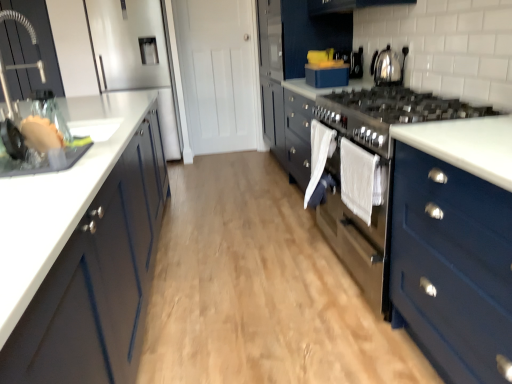
Question: Would you consider brushed metal faucet at left, the second cabinetry from the right, to be distant from matte blue dresser at center?

Choices:
 (A) yes
 (B) no

Answer: (A)

Question: From a real-world perspective, does brushed metal faucet at left, which is the 2th cabinetry from left to right, stand above matte blue dresser at center?

Choices:
 (A) yes
 (B) no

Answer: (A)

Question: Is brushed metal faucet at left, the second cabinetry from the right, completely or partially outside of matte blue dresser at center?

Choices:
 (A) yes
 (B) no

Answer: (A)

Question: Considering the relative sizes of brushed metal faucet at left, which is the 2th cabinetry from left to right, and matte blue dresser at center in the image provided, is brushed metal faucet at left, which is the 2th cabinetry from left to right, shorter than matte blue dresser at center?

Choices:
 (A) yes
 (B) no

Answer: (A)

Question: Can you confirm if brushed metal faucet at left, which is the 2th cabinetry from left to right, is bigger than matte blue dresser at center?

Choices:
 (A) yes
 (B) no

Answer: (B)

Question: Is brushed metal faucet at left, which is the 2th cabinetry from left to right, inside or outside of white fabric towel at center, which is counted as the first clothe, starting from the back?

Choices:
 (A) outside
 (B) inside

Answer: (A)

Question: From the image's perspective, is brushed metal faucet at left, the second cabinetry from the right, above or below white fabric towel at center, which is counted as the first clothe, starting from the back?

Choices:
 (A) above
 (B) below

Answer: (A)

Question: Relative to white fabric towel at center, which is the 2th clothe in front-to-back order, is brushed metal faucet at left, the second cabinetry from the right, in front or behind?

Choices:
 (A) front
 (B) behind

Answer: (A)

Question: From a real-world perspective, is brushed metal faucet at left, which is the 2th cabinetry from left to right, physically located above or below white fabric towel at center, which is counted as the first clothe, starting from the back?

Choices:
 (A) below
 (B) above

Answer: (B)

Question: From a real-world perspective, is white fabric towel at center, which is counted as the first clothe, starting from the back, above or below white cotton towel at center, marked as the 2th clothe in a back-to-front arrangement?

Choices:
 (A) below
 (B) above

Answer: (A)

Question: In the image, is white fabric towel at center, which is counted as the first clothe, starting from the back, positioned in front of or behind white cotton towel at center, marked as the 2th clothe in a back-to-front arrangement?

Choices:
 (A) front
 (B) behind

Answer: (B)

Question: Do you think white fabric towel at center, which is the 2th clothe in front-to-back order, is within white cotton towel at center, which ranks as the 1th clothe in front-to-back order, or outside of it?

Choices:
 (A) inside
 (B) outside

Answer: (B)

Question: Considering the relative positions of white fabric towel at center, which is counted as the first clothe, starting from the back, and white cotton towel at center, which ranks as the 1th clothe in front-to-back order, in the image provided, is white fabric towel at center, which is counted as the first clothe, starting from the back, to the left or to the right of white cotton towel at center, which ranks as the 1th clothe in front-to-back order,?

Choices:
 (A) left
 (B) right

Answer: (A)

Question: Do you think matte blue dresser at center is within wooden floor at center, or outside of it?

Choices:
 (A) outside
 (B) inside

Answer: (A)

Question: Is matte blue dresser at center taller or shorter than wooden floor at center?

Choices:
 (A) tall
 (B) short

Answer: (A)